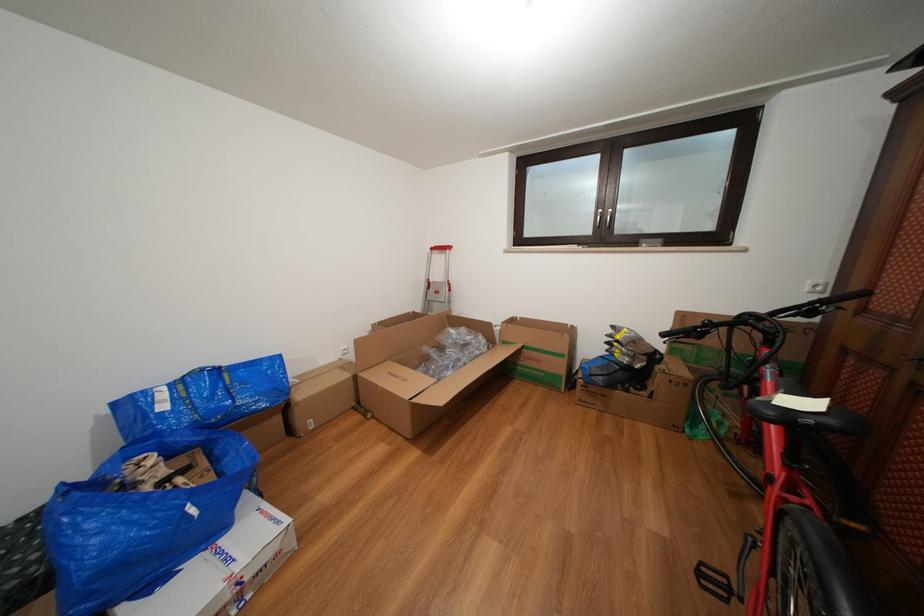
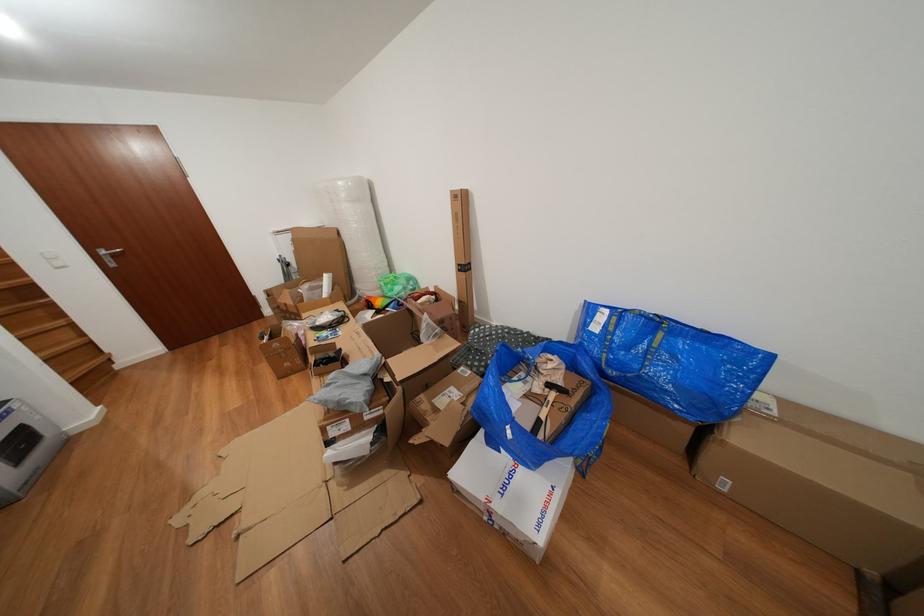
The point at (297,399) is marked in the first image. Where is the corresponding point in the second image?

(734, 424)